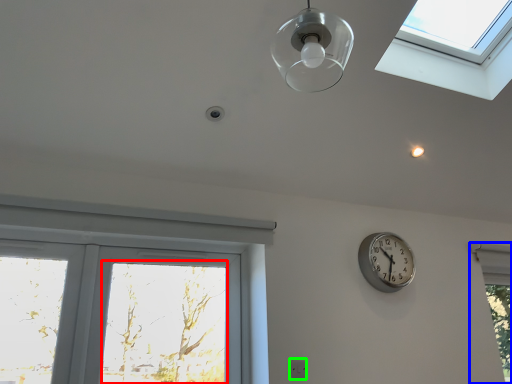
Question: Which object is positioned farthest from window screen (highlighted by a red box)? Select from window (highlighted by a blue box) and electric outlet (highlighted by a green box).

Choices:
 (A) window
 (B) electric outlet

Answer: (A)